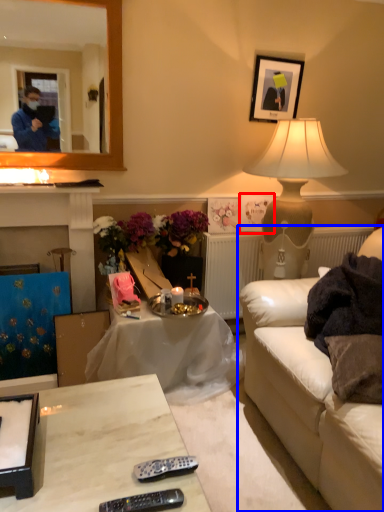
Question: Which object appears closest to the camera in this image, picture frame (highlighted by a red box) or studio couch (highlighted by a blue box)?

Choices:
 (A) picture frame
 (B) studio couch

Answer: (B)